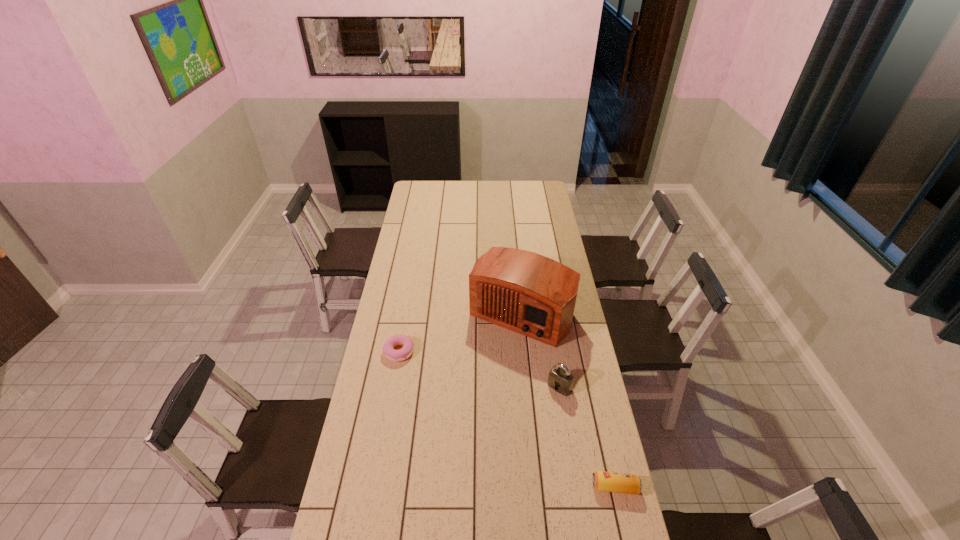
Where is `vacant spot on the desktop that is between the leftmost object and the beer can and is positioned on the front-facing side of the tallest object`? Image resolution: width=960 pixels, height=540 pixels. vacant spot on the desktop that is between the leftmost object and the beer can and is positioned on the front-facing side of the tallest object is located at coordinates (469, 396).

Find the location of a particular element. This screenshot has height=540, width=960. vacant space on the desktop that is between the leftmost object and the beer can and is positioned at the front of the second tallest object near the keyhole is located at coordinates (523, 429).